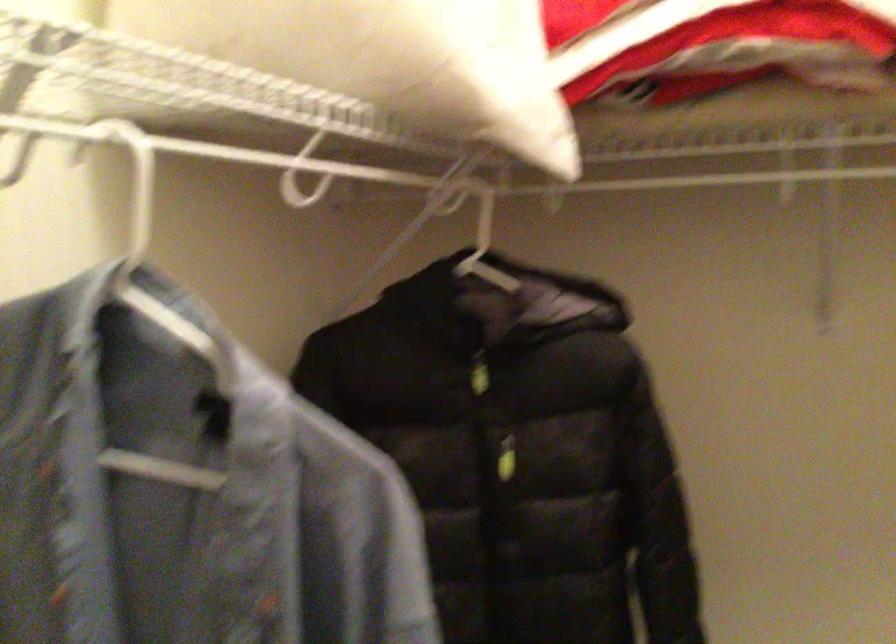
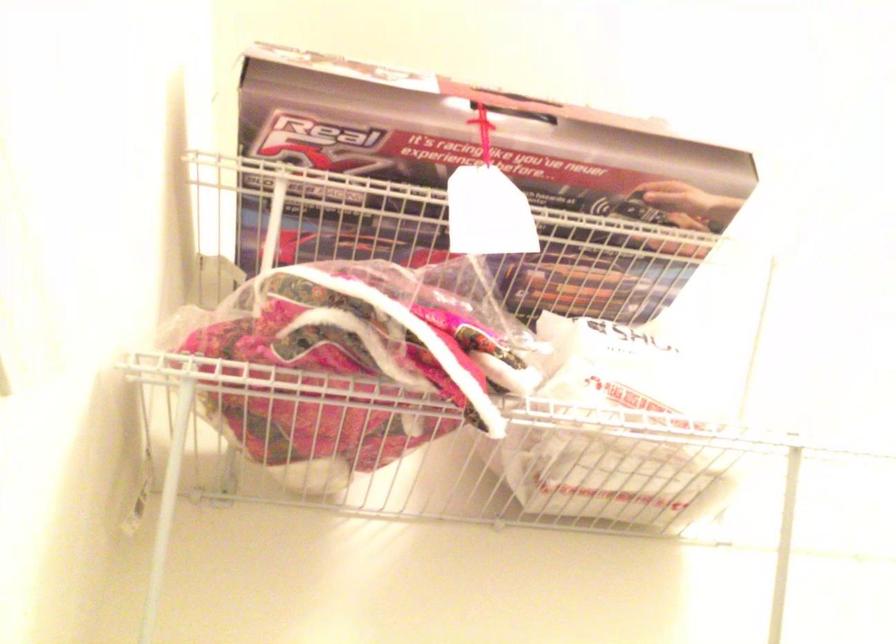
The first image is from the beginning of the video and the second image is from the end. How did the camera likely rotate when shooting the video?

The rotation direction of the camera is left-up.